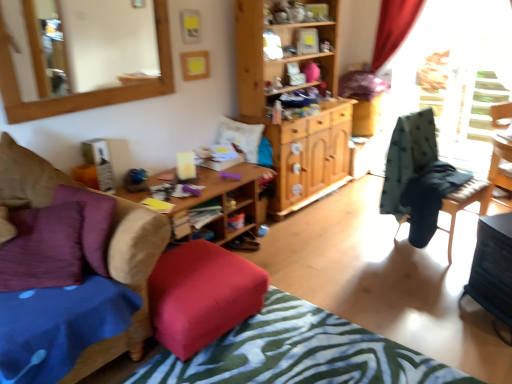
This screenshot has width=512, height=384. I want to click on vacant space that is in between wooden chair at right, acting as the 2th chair starting from the left, and textured green and white bedspread at lower center, so click(x=397, y=291).